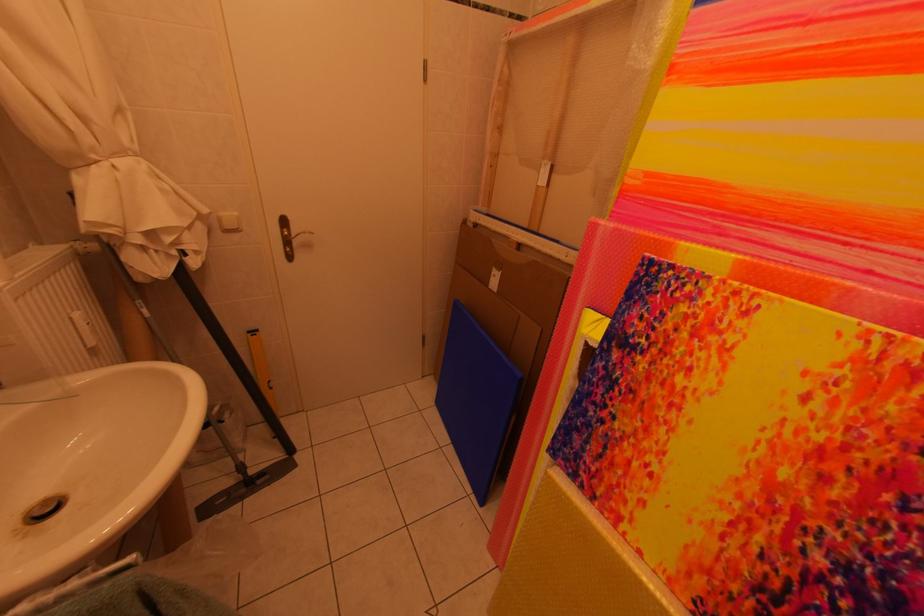
This screenshot has width=924, height=616. What do you see at coordinates (287, 237) in the screenshot?
I see `the brass door handle` at bounding box center [287, 237].